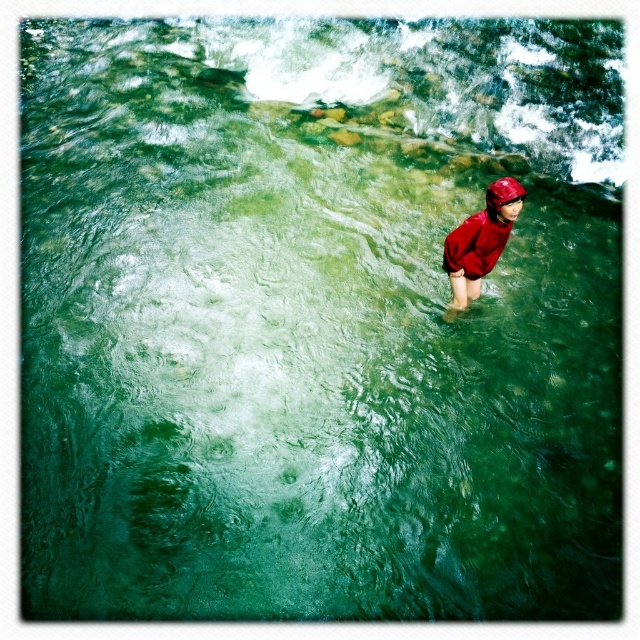
Question: Among these points, which one is farthest from the camera?

Choices:
 (A) (493, 198)
 (B) (467, 218)

Answer: (B)

Question: Which of the following is the closest to the observer?

Choices:
 (A) (518, 198)
 (B) (467, 300)

Answer: (A)

Question: Is matte red raincoat at center further to camera compared to red matte helmet at upper center?

Choices:
 (A) yes
 (B) no

Answer: (B)

Question: Is matte red raincoat at center smaller than red matte helmet at upper center?

Choices:
 (A) yes
 (B) no

Answer: (B)

Question: Is matte red raincoat at center bigger than red matte helmet at upper center?

Choices:
 (A) no
 (B) yes

Answer: (B)

Question: Which point is closer to the camera taking this photo?

Choices:
 (A) (509, 202)
 (B) (506, 182)

Answer: (A)